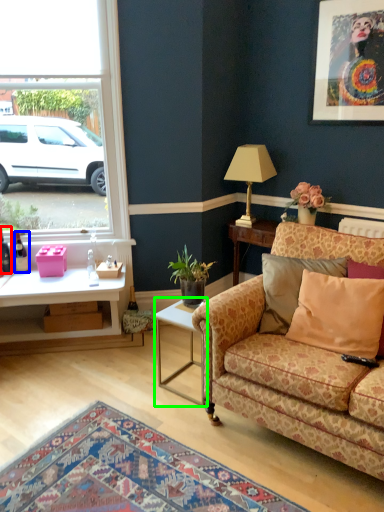
Question: Estimate the real-world distances between objects in this image. Which object is closer to bottle (highlighted by a red box), bottle (highlighted by a blue box) or table (highlighted by a green box)?

Choices:
 (A) bottle
 (B) table

Answer: (A)